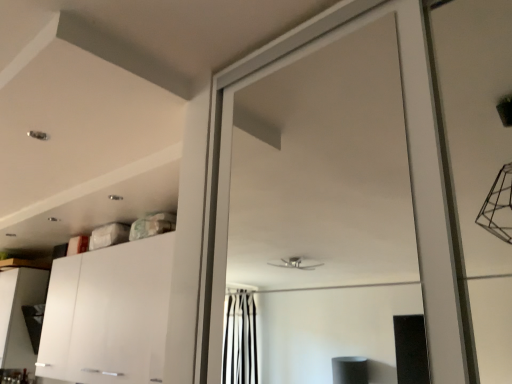
Question: In terms of width, does white glossy cabinet at lower left, the 1th cabinetry viewed from the back, look wider or thinner when compared to white glossy cabinet at lower left, which is the first cabinetry from right to left?

Choices:
 (A) wide
 (B) thin

Answer: (A)

Question: From the image's perspective, is white glossy cabinet at lower left, the second cabinetry when ordered from front to back, above or below white glossy cabinet at lower left, which is the second cabinetry from left to right?

Choices:
 (A) below
 (B) above

Answer: (A)

Question: From their relative heights in the image, would you say white glossy cabinet at lower left, the second cabinetry when ordered from front to back, is taller or shorter than white glossy cabinet at lower left, placed as the second cabinetry when sorted from back to front?

Choices:
 (A) short
 (B) tall

Answer: (A)

Question: Is white glossy cabinet at lower left, the first cabinetry positioned from the front, inside or outside of white glossy cabinet at lower left, the 1th cabinetry viewed from the back?

Choices:
 (A) inside
 (B) outside

Answer: (B)

Question: From the image's perspective, relative to white glossy cabinet at lower left, the second cabinetry when ordered from front to back, is white glossy cabinet at lower left, which is the second cabinetry from left to right, above or below?

Choices:
 (A) below
 (B) above

Answer: (B)

Question: Considering the positions of white glossy cabinet at lower left, which is the first cabinetry from right to left, and white glossy cabinet at lower left, the 1th cabinetry viewed from the back, in the image, is white glossy cabinet at lower left, which is the first cabinetry from right to left, taller or shorter than white glossy cabinet at lower left, the 1th cabinetry viewed from the back,?

Choices:
 (A) short
 (B) tall

Answer: (B)

Question: In terms of width, does white glossy cabinet at lower left, which is the first cabinetry from right to left, look wider or thinner when compared to white glossy cabinet at lower left, the second cabinetry when ordered from right to left?

Choices:
 (A) thin
 (B) wide

Answer: (A)